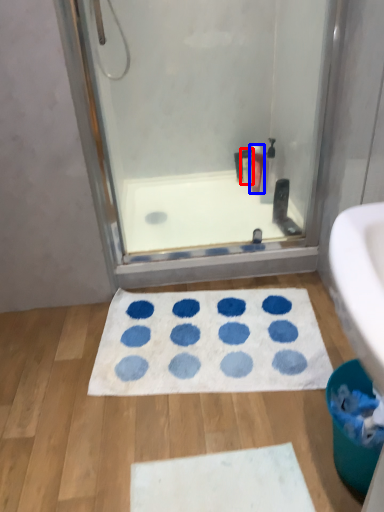
Question: Which object is closer to the camera taking this photo, toiletry (highlighted by a red box) or cleaning product (highlighted by a blue box)?

Choices:
 (A) toiletry
 (B) cleaning product

Answer: (B)